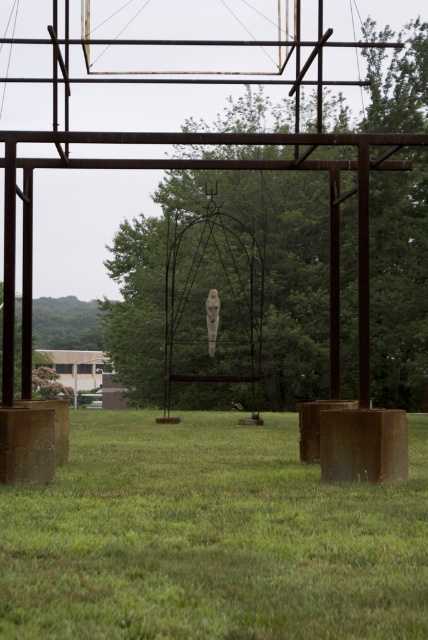
Question: Which point is farther to the camera?

Choices:
 (A) (404, 76)
 (B) (92, 544)
 (C) (219, 305)

Answer: (A)

Question: Can you confirm if green grass at center is positioned above white marble statue at center?

Choices:
 (A) no
 (B) yes

Answer: (A)

Question: Where is green grass at center located in relation to green leafy tree at center in the image?

Choices:
 (A) above
 (B) below

Answer: (B)

Question: Does green grass at center have a greater width compared to white marble statue at center?

Choices:
 (A) no
 (B) yes

Answer: (B)

Question: Which object is positioned closest to the green grass at center?

Choices:
 (A) green leafy tree at center
 (B) white marble statue at center

Answer: (B)

Question: Which object is closer to the camera taking this photo?

Choices:
 (A) white marble statue at center
 (B) green grass at center
 (C) green leafy tree at center

Answer: (B)